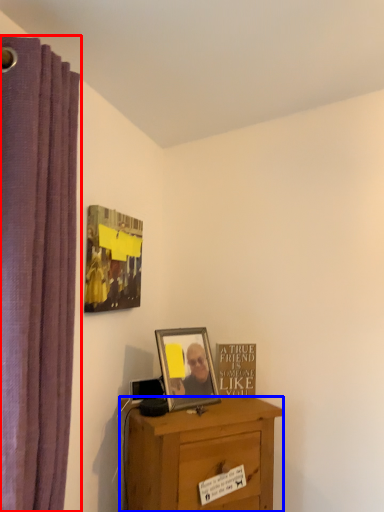
Question: Which point is closer to the camera, curtain (highlighted by a red box) or desk (highlighted by a blue box)?

Choices:
 (A) curtain
 (B) desk

Answer: (A)